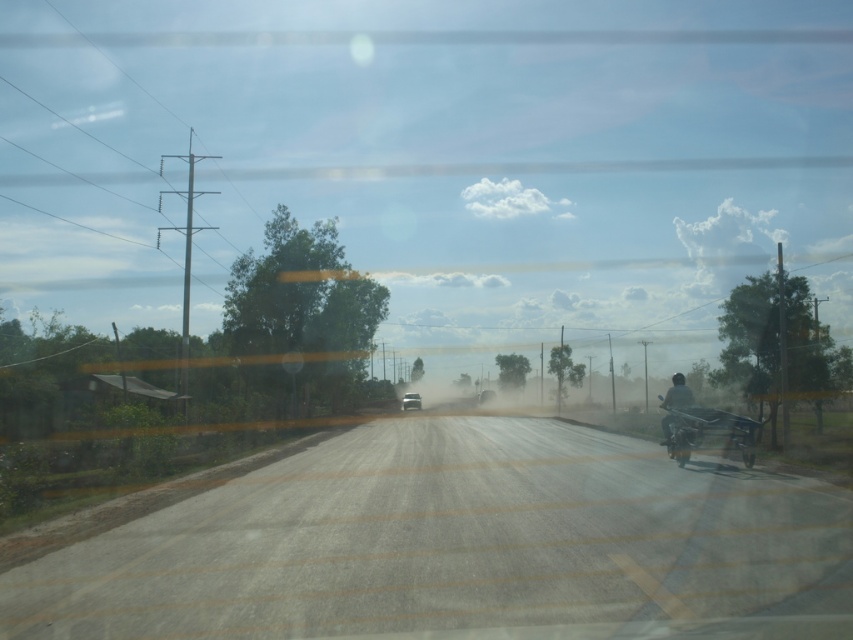
You are driving a car that is 4.5 meters long. You see a dust cloud ahead and want to stop before reaching the point where the dust cloud starts. The point where you need to stop is marked as point (672,432). Can your car fit entirely behind this point without overlapping it?

The distance between you and point (672,432) is 18.81 meters. Since your car is only 4.5 meters long, there is enough space to stop entirely behind the point (672,432).